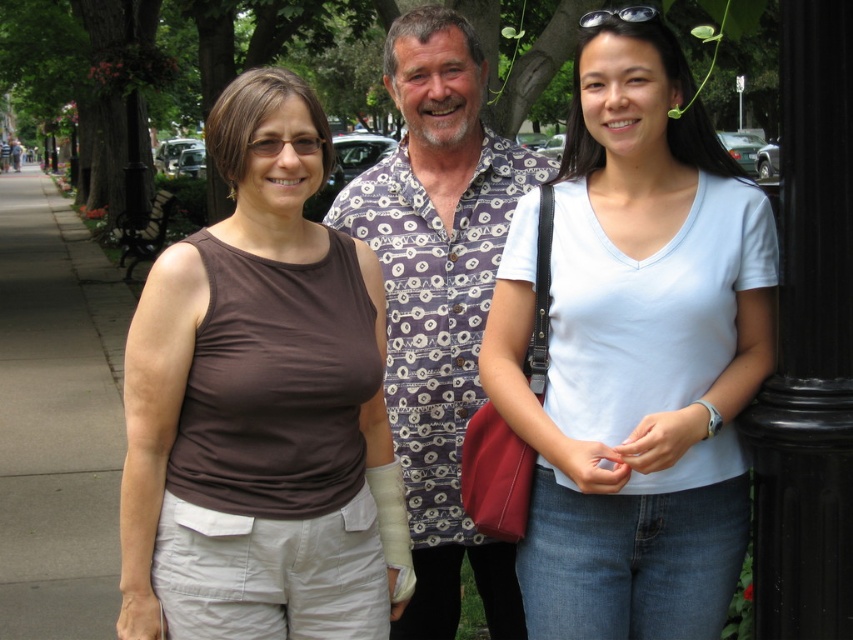
At what (x,y) coordinates should I click in order to perform the action: click on light blue cotton shirt at center. Please return your answer as a coordinate pair (x, y). Looking at the image, I should click on (636, 353).

Find the location of a particular element. Image resolution: width=853 pixels, height=640 pixels. light blue cotton shirt at center is located at coordinates (636, 353).

Which is more to the right, light blue cotton shirt at center or brown matte tank top at center?

light blue cotton shirt at center is more to the right.

Does light blue cotton shirt at center appear over brown matte tank top at center?

Indeed, light blue cotton shirt at center is positioned over brown matte tank top at center.

Locate an element on the screen. This screenshot has height=640, width=853. light blue cotton shirt at center is located at coordinates (636, 353).

In the scene shown: Between gray concrete sidewalk at left and black plastic goggles at upper center, which one has more height?

gray concrete sidewalk at left

What do you see at coordinates (57, 417) in the screenshot? I see `gray concrete sidewalk at left` at bounding box center [57, 417].

Is point (54, 212) positioned before point (619, 10)?

No.

You are a GUI agent. You are given a task and a screenshot of the screen. Output one action in this format:
    pyautogui.click(x=<x>, y=<y>)
    Task: Click on the gray concrete sidewalk at left
    
    Given the screenshot: What is the action you would take?
    pyautogui.click(x=57, y=417)